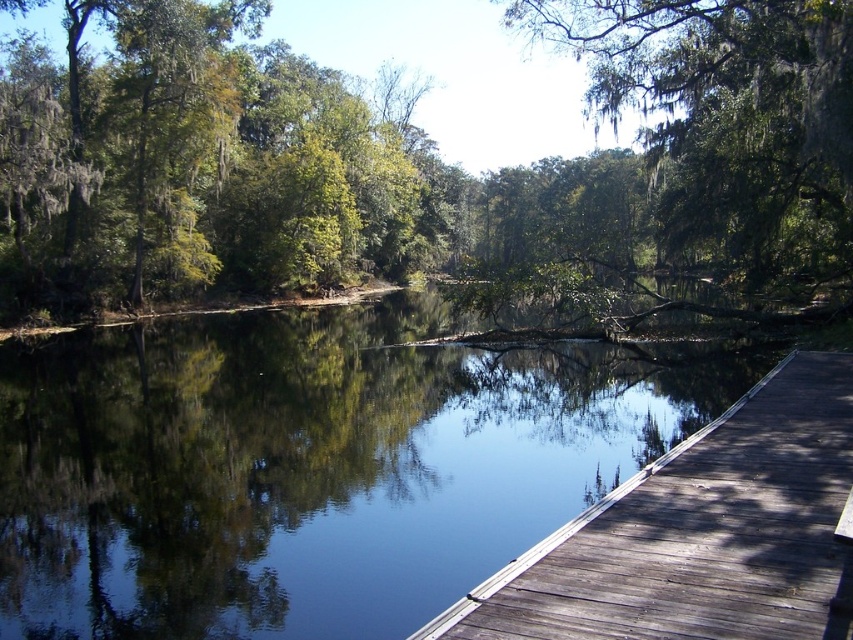
You are standing on the wooden dock and looking towards the center of the image. Which object, the green leafy tree at center or the smooth dark water at center, would appear closer to you?

The green leafy tree at center would appear closer because it is in front of the smooth dark water at center according to the spatial relationship described.

You are standing on the wooden dock and looking towards the green mossy tree at upper center. Which direction should you face to see the smooth dark water at center?

You should face to the left of the green mossy tree at upper center to see the smooth dark water at center, as the smooth dark water at center is located to the left of the green mossy tree at upper center.

You are a hiker who has just arrived at the lakeside. You see the smooth dark water at center and the green mossy tree at upper center. Which object is positioned higher in the scene?

The green mossy tree at upper center is positioned higher in the scene than the smooth dark water at center.